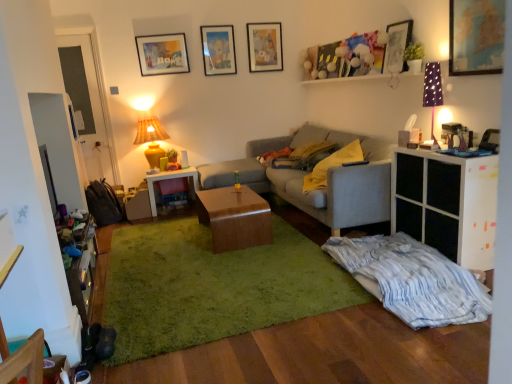
The height and width of the screenshot is (384, 512). What do you see at coordinates (151, 139) in the screenshot? I see `matte yellow ceramic lamp at upper left, placed as the first lamp when sorted from back to front` at bounding box center [151, 139].

The height and width of the screenshot is (384, 512). What are the coordinates of `polka dot fabric lampshade at upper right, which is the 2th lamp from left to right` in the screenshot? It's located at (432, 91).

Identify the location of matte black picture frame at upper right, marked as the 2th picture frame in a right-to-left arrangement. (397, 46).

What do you see at coordinates (84, 274) in the screenshot? I see `wooden dresser at lower left` at bounding box center [84, 274].

The image size is (512, 384). Describe the element at coordinates (412, 280) in the screenshot. I see `white striped fabric at lower right` at that location.

At what (x,y) coordinates should I click in order to perform the action: click on glossy brown coffee table at center. Please return your answer as a coordinate pair (x, y). The height and width of the screenshot is (384, 512). Looking at the image, I should click on (234, 218).

Considering the positions of objects yellow fabric pillow at center and white matte cabinet at right in the image provided, who is in front, yellow fabric pillow at center or white matte cabinet at right?

white matte cabinet at right.

Could white matte cabinet at right be considered to be inside yellow fabric pillow at center?

No, white matte cabinet at right is located outside of yellow fabric pillow at center.

From a real-world perspective, which is physically above, yellow fabric pillow at center or white matte cabinet at right?

In real-world perspective, yellow fabric pillow at center is above.

Is glossy brown coffee table at center touching green shaggy rug at center?

No, glossy brown coffee table at center is not touching green shaggy rug at center.

Considering the relative sizes of glossy brown coffee table at center and green shaggy rug at center in the image provided, is glossy brown coffee table at center smaller than green shaggy rug at center?

Correct, glossy brown coffee table at center occupies less space than green shaggy rug at center.

From a real-world perspective, is glossy brown coffee table at center below green shaggy rug at center?

No, from a real-world perspective, glossy brown coffee table at center is not under green shaggy rug at center.

Is glossy brown coffee table at center closer to the viewer compared to green shaggy rug at center?

No, glossy brown coffee table at center is further to the viewer.

Does green shaggy rug at center have a greater width compared to white glossy desk at center?

Yes.

Is green shaggy rug at center oriented towards white glossy desk at center?

No.

From the image's perspective, which one is positioned higher, green shaggy rug at center or white glossy desk at center?

From the image's view, white glossy desk at center is above.

Does point (169, 239) come closer to viewer compared to point (176, 175)?

Yes, point (169, 239) is closer to viewer.

Who is bigger, white glossy desk at center or green shaggy rug at center?

Bigger between the two is green shaggy rug at center.

Is point (197, 178) less distant than point (144, 300)?

No, it is behind (144, 300).

Is white glossy desk at center behind green shaggy rug at center?

Yes, white glossy desk at center is further from the viewer.

The height and width of the screenshot is (384, 512). Find the location of `plain located on the right of white glossy desk at center`. plain located on the right of white glossy desk at center is located at coordinates (215, 284).

Does matte yellow ceramic lamp at upper left, placed as the first lamp when sorted from back to front, have a smaller size compared to white glossy desk at center?

Indeed, matte yellow ceramic lamp at upper left, placed as the first lamp when sorted from back to front, has a smaller size compared to white glossy desk at center.

Which object is positioned more to the right, matte yellow ceramic lamp at upper left, acting as the second lamp starting from the right, or white glossy desk at center?

From the viewer's perspective, white glossy desk at center appears more on the right side.

Which point is more forward, (312, 235) or (220, 246)?

The point (220, 246) is closer.

Which is more to the left, green shaggy rug at center or glossy brown coffee table at center?

green shaggy rug at center is more to the left.

Locate an element on the screen. table above the green shaggy rug at center (from a real-world perspective) is located at coordinates (234, 218).

Is green shaggy rug at center directly adjacent to glossy brown coffee table at center?

green shaggy rug at center is not next to glossy brown coffee table at center, and they're not touching.

The width and height of the screenshot is (512, 384). I want to click on the 1st picture frame located above the yellow fabric pillow at center (from a real-world perspective), so click(397, 46).

Measure the distance from yellow fabric pillow at center to matte black picture frame at upper right, marked as the 2th picture frame in a right-to-left arrangement.

yellow fabric pillow at center and matte black picture frame at upper right, marked as the 2th picture frame in a right-to-left arrangement, are 36.04 inches apart from each other.

From the image's perspective, between yellow fabric pillow at center and matte black picture frame at upper right, the fourth picture frame from the back, who is located below?

yellow fabric pillow at center, from the image's perspective.

Considering the relative positions of yellow fabric pillow at center and matte black picture frame at upper right, marked as the 2th picture frame in a right-to-left arrangement, in the image provided, is yellow fabric pillow at center to the left of matte black picture frame at upper right, marked as the 2th picture frame in a right-to-left arrangement, from the viewer's perspective?

Correct, you'll find yellow fabric pillow at center to the left of matte black picture frame at upper right, marked as the 2th picture frame in a right-to-left arrangement.

The image size is (512, 384). I want to click on pillow that appears above the white matte cabinet at right (from the image's perspective), so click(x=332, y=165).

Find the location of a particular element. This screenshot has width=512, height=384. plain below the glossy brown coffee table at center (from the image's perspective) is located at coordinates (215, 284).

When comparing their distances from map paper picture frame at upper right, positioned as the 5th picture frame in left-to-right order, does yellow fabric pillow at center or matte wooden picture frame at upper center, the 1th picture frame in the back-to-front sequence, seem closer?

yellow fabric pillow at center is closer to map paper picture frame at upper right, positioned as the 5th picture frame in left-to-right order.

From the image, which object appears to be nearer to gray fabric couch at center, wooden dresser at lower left or white glossy desk at center?

white glossy desk at center is positioned closer to the anchor gray fabric couch at center.

Looking at the image, which one is located closer to green shaggy rug at center, white striped fabric at lower right or matte yellow ceramic lamp at upper left, the 1th lamp from the left?

white striped fabric at lower right.

In the scene shown: From the image, which object appears to be farther from matte yellow ceramic lamp at upper left, the 1th lamp from the left, white striped fabric at lower right or gray fabric couch at center?

Among the two, white striped fabric at lower right is located further to matte yellow ceramic lamp at upper left, the 1th lamp from the left.

Consider the image. From the image, which object appears to be farther from map paper picture frame at upper right, the 1th picture frame when ordered from front to back, white matte cabinet at right or glossy brown coffee table at center?

Among the two, glossy brown coffee table at center is located further to map paper picture frame at upper right, the 1th picture frame when ordered from front to back.

In the scene shown: Estimate the real-world distances between objects in this image. Which object is further from matte paper picture frame at upper center, which ranks as the fifth picture frame in right-to-left order, glossy brown coffee table at center or matte wooden picture frame at upper center, which ranks as the third picture frame in right-to-left order?

The object further to matte paper picture frame at upper center, which ranks as the fifth picture frame in right-to-left order, is glossy brown coffee table at center.

Looking at the image, which one is located closer to wooden dresser at lower left, matte wooden picture frame at upper center, the 3th picture frame positioned from the left, or matte wooden picture frame at upper center, the 2th picture frame when ordered from left to right?

matte wooden picture frame at upper center, the 2th picture frame when ordered from left to right.

Looking at the image, which one is located further to yellow fabric pillow at center, matte wooden picture frame at upper center, the 3th picture frame positioned from the left, or matte black picture frame at upper right, which ranks as the second picture frame in front-to-back order?

matte wooden picture frame at upper center, the 3th picture frame positioned from the left, lies further to yellow fabric pillow at center than the other object.

Find the location of a particular element. studio couch between matte yellow ceramic lamp at upper left, the 2th lamp viewed from the front, and map paper picture frame at upper right, the 5th picture frame viewed from the back is located at coordinates (316, 190).

Locate an element on the screen. Image resolution: width=512 pixels, height=384 pixels. cabinetry between wooden armchair at lower left and matte paper picture frame at upper center, positioned as the 1th picture frame in left-to-right order, in the front-back direction is located at coordinates (447, 203).

At what (x,y) coordinates should I click in order to perform the action: click on table between white matte cabinet at right and matte wooden picture frame at upper center, the 2th picture frame when ordered from left to right, from front to back. Please return your answer as a coordinate pair (x, y). This screenshot has height=384, width=512. Looking at the image, I should click on (234, 218).

Locate an element on the screen. The image size is (512, 384). studio couch between green shaggy rug at center and polka dot fabric lampshade at upper right, the first lamp when ordered from right to left, in the horizontal direction is located at coordinates (316, 190).